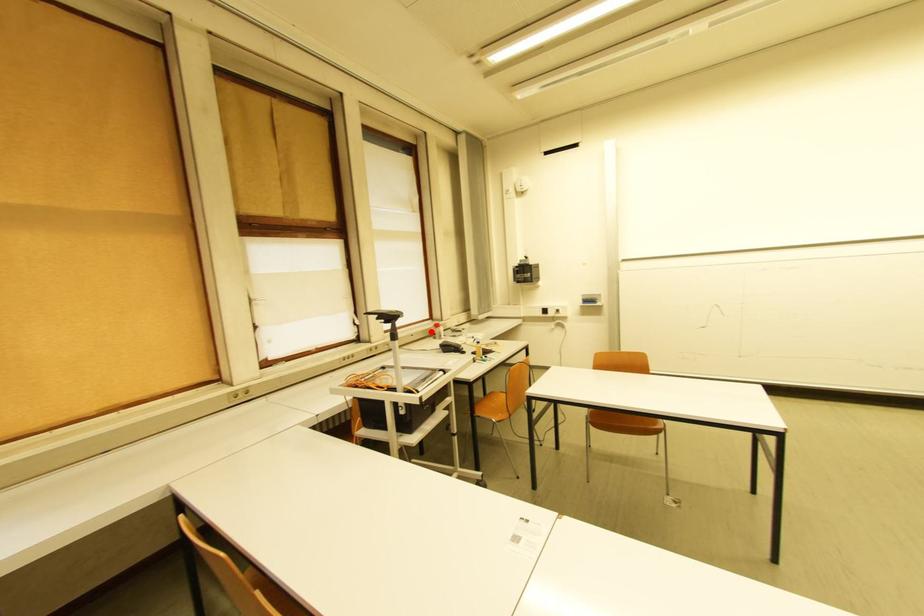
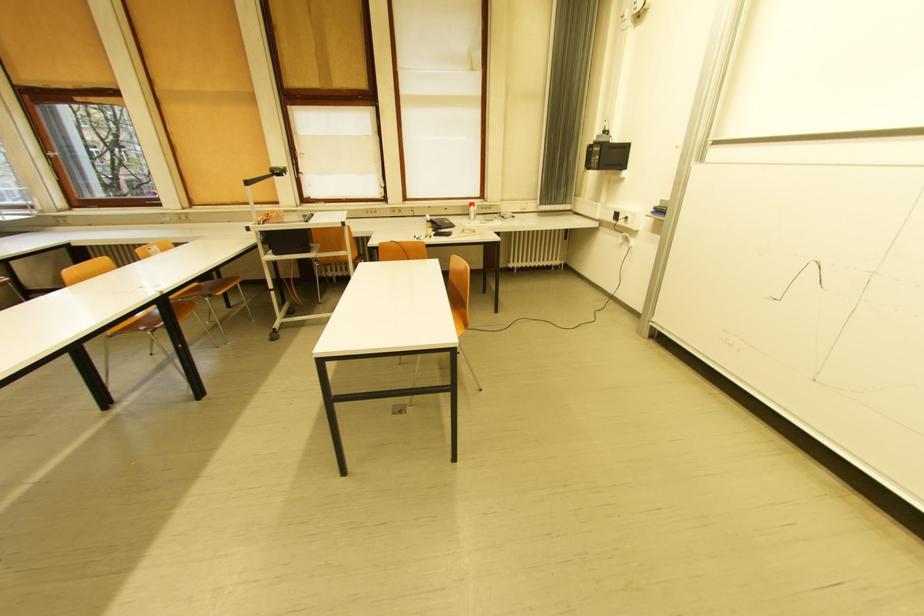
Locate, in the second image, the point that corresponds to the highlighted location in the first image.

(469, 208)